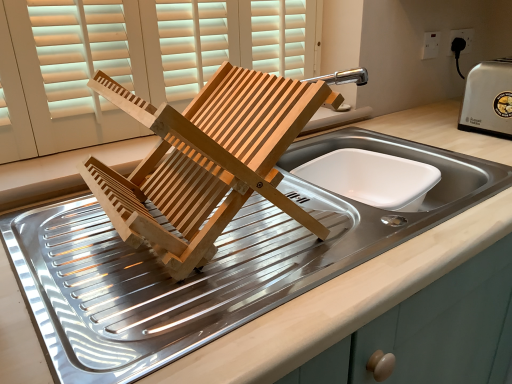
You are a GUI agent. You are given a task and a screenshot of the screen. Output one action in this format:
    pyautogui.click(x=<x>, y=<y>)
    Task: Click on the natural wood dish rack at center
    This screenshot has height=384, width=512.
    Given the screenshot: What is the action you would take?
    pyautogui.click(x=206, y=161)

What do you see at coordinates (206, 161) in the screenshot? I see `natural wood dish rack at center` at bounding box center [206, 161].

Locate an element on the screen. natural wood dish rack at center is located at coordinates pos(206,161).